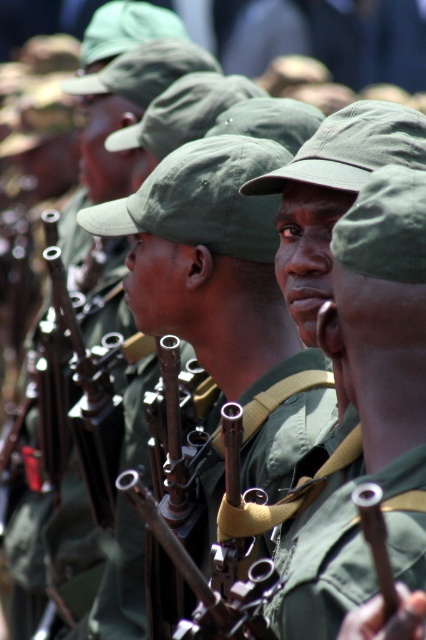
Question: Is matte green uniform at center thinner than green fabric uniform at center?

Choices:
 (A) no
 (B) yes

Answer: (A)

Question: Can you confirm if matte green uniform at center is positioned above green fabric uniform at center?

Choices:
 (A) no
 (B) yes

Answer: (B)

Question: Which object is farther from the camera taking this photo?

Choices:
 (A) green fabric uniform at center
 (B) matte green uniform at center

Answer: (B)

Question: Considering the relative positions of matte green uniform at center and green fabric uniform at center in the image provided, where is matte green uniform at center located with respect to green fabric uniform at center?

Choices:
 (A) left
 (B) right

Answer: (B)

Question: Which point is closer to the camera?

Choices:
 (A) matte green uniform at center
 (B) green fabric uniform at center

Answer: (B)